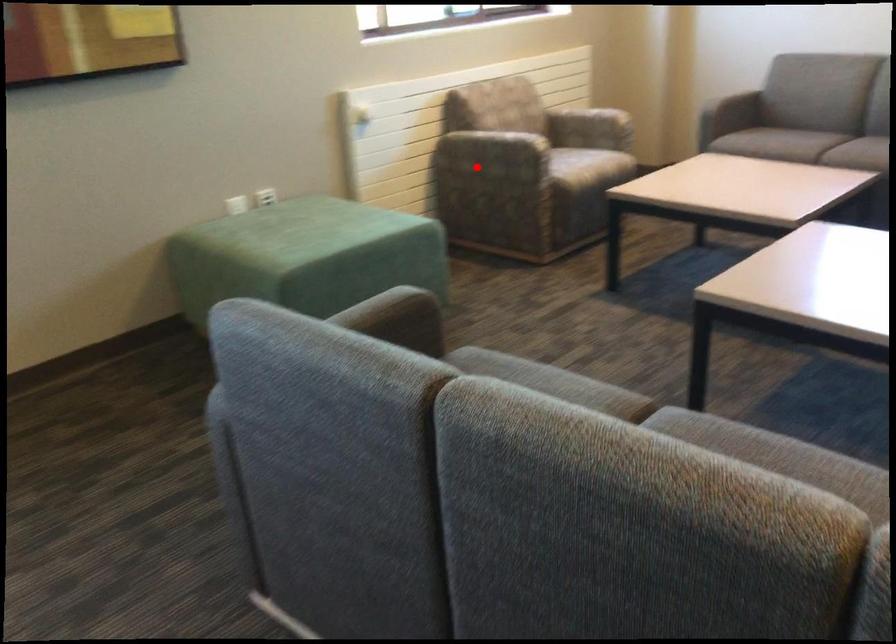
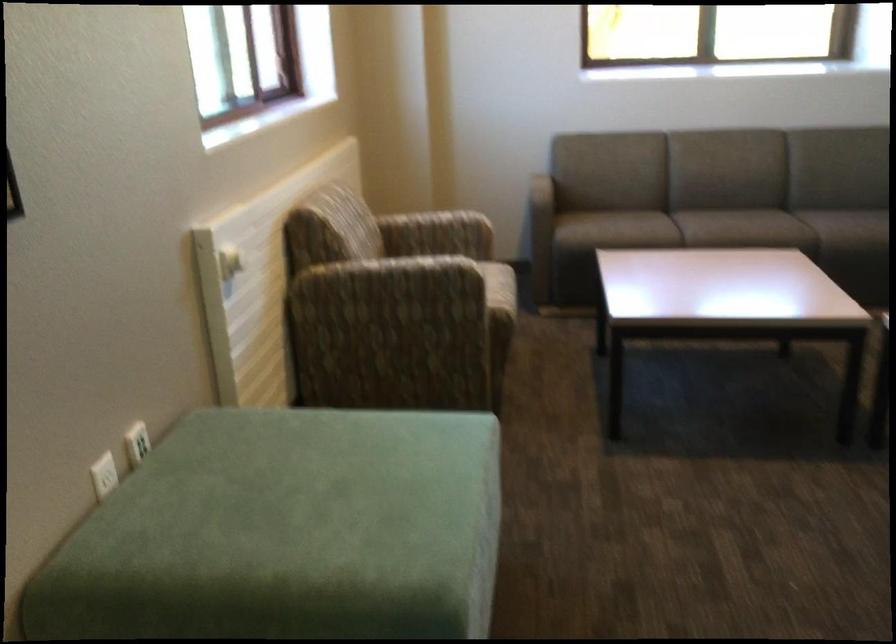
The point at the highlighted location is marked in the first image. Where is the corresponding point in the second image?

(386, 312)